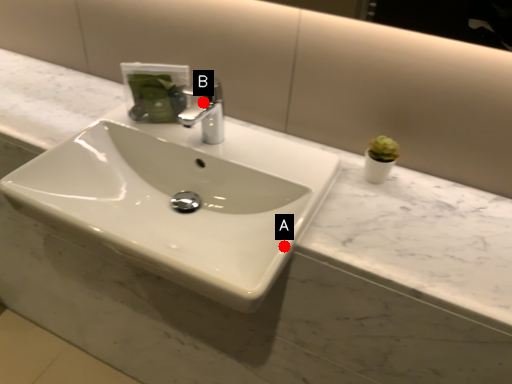
Question: Two points are circled on the image, labeled by A and B beside each circle. Which of the following is the farthest from the observer?

Choices:
 (A) A is further
 (B) B is further

Answer: (B)